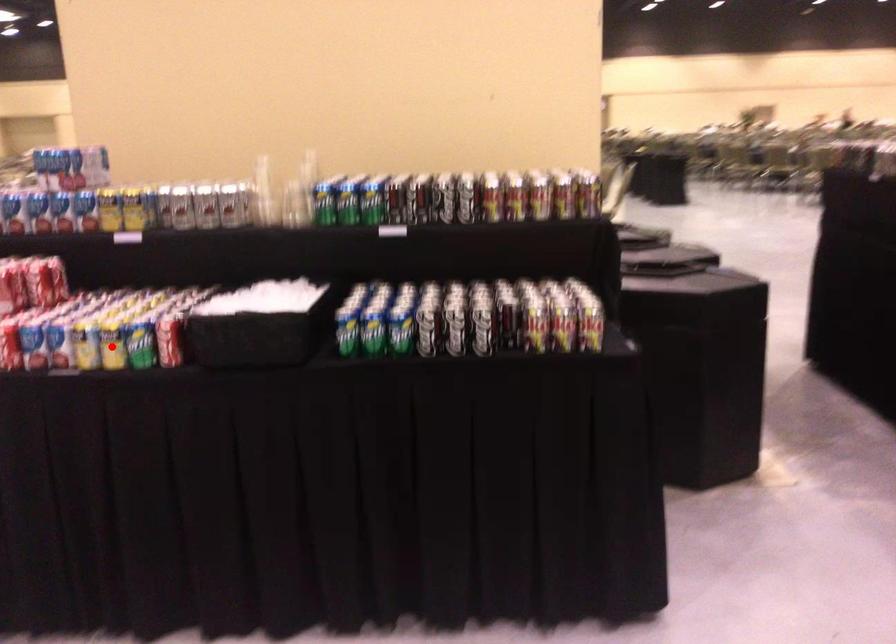
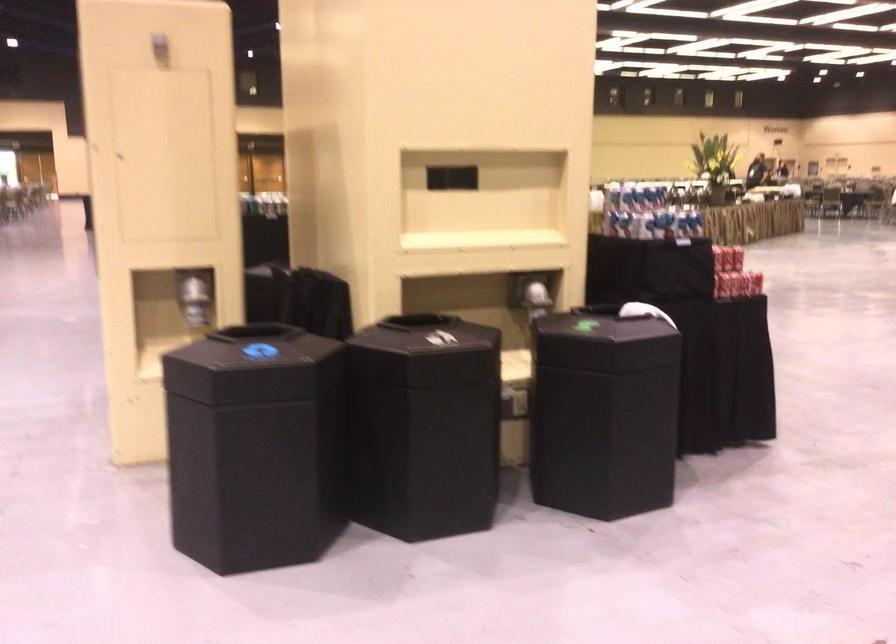
Question: I am providing you with two images of the same scene from different viewpoints. A red point is marked on the first image. Is the red point's position out of view in image 2?

Choices:
 (A) Yes
 (B) No

Answer: (A)